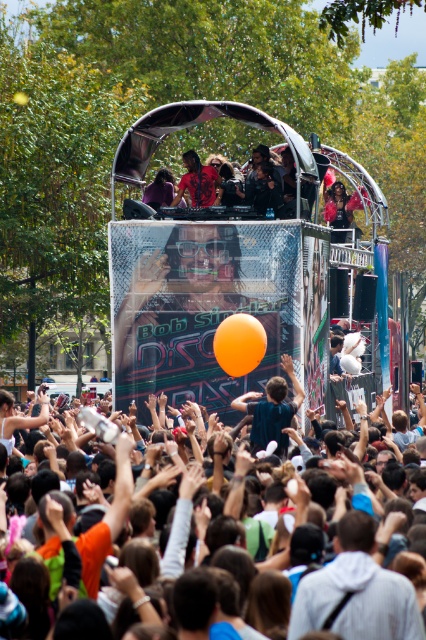
You are a photographer positioned at the bottom left corner of the image. You want to take a photo of the matte orange balloon at center. Considering your current position, which direction should you move to get the balloon into the frame?

Since the matte orange balloon at center is located at point [360,588], which is near the upper right corner of the image, you should move towards the upper right direction to position yourself closer to the balloon and ensure it is centered in your frame.

You are at the festival and want to take a photo of the DJ platform. There are two orange balloons at the center of the image. Which balloon is closer to the DJ platform, the matte orange balloon at center or the orange rubber balloon at center?

The matte orange balloon at center is positioned under the orange rubber balloon at center, so the matte orange balloon at center is closer to the DJ platform.